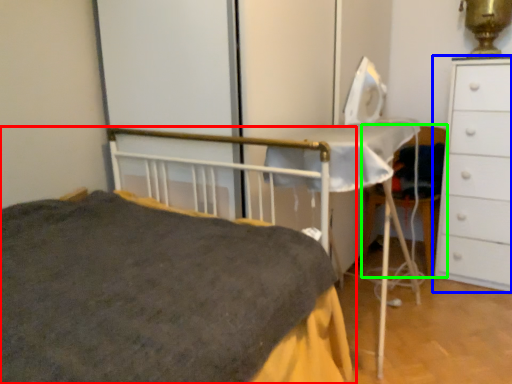
Question: Considering the real-world distances, which object is farthest from bed (highlighted by a red box)? chest of drawers (highlighted by a blue box) or chair (highlighted by a green box)?

Choices:
 (A) chest of drawers
 (B) chair

Answer: (B)